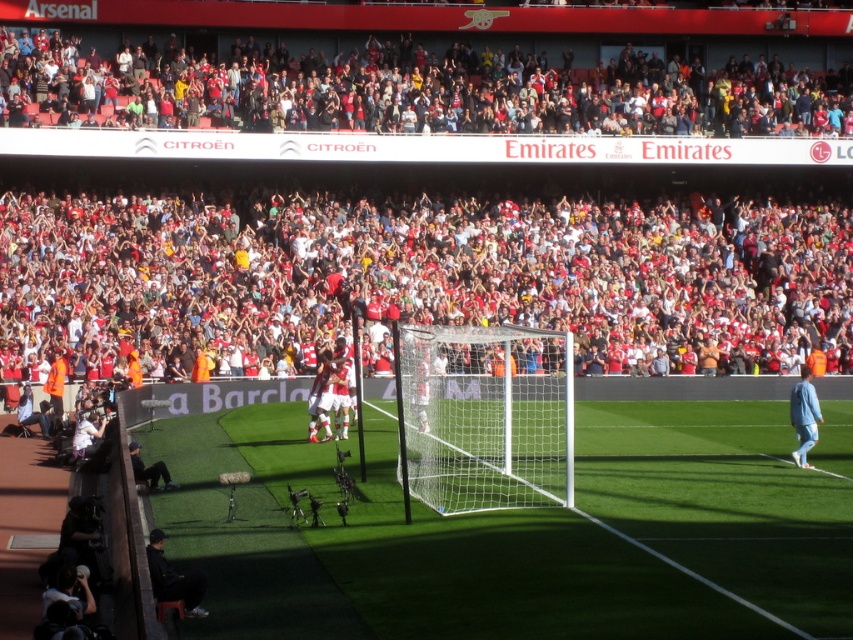
Question: Which object appears farthest from the camera in this image?

Choices:
 (A) green artificial turf at center
 (B) red fabric crowd at upper center
 (C) blue fabric jersey at right

Answer: (B)

Question: Is green artificial turf at center wider than white mesh net at center?

Choices:
 (A) yes
 (B) no

Answer: (A)

Question: Is green artificial turf at center to the right of blue fabric jersey at right from the viewer's perspective?

Choices:
 (A) yes
 (B) no

Answer: (B)

Question: Based on their relative distances, which object is nearer to the blue fabric jersey at right?

Choices:
 (A) red fabric crowd at upper center
 (B) green artificial turf at center
 (C) white mesh net at center

Answer: (C)

Question: Which point is closer to the camera taking this photo?

Choices:
 (A) (415, 378)
 (B) (701, 632)
 (C) (558, 116)

Answer: (B)

Question: Is green artificial turf at center further to the viewer compared to red fabric crowd at upper center?

Choices:
 (A) no
 (B) yes

Answer: (A)